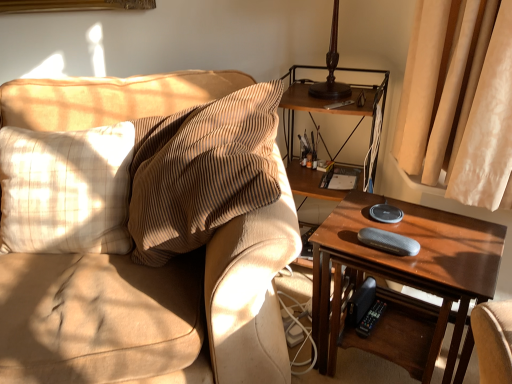
Question: From a real-world perspective, is beige plaid pillow at left positioned above or below wooden shelf at right?

Choices:
 (A) below
 (B) above

Answer: (B)

Question: From their relative heights in the image, would you say beige plaid pillow at left is taller or shorter than wooden shelf at right?

Choices:
 (A) short
 (B) tall

Answer: (A)

Question: Considering the real-world distances, which object is closest to the wooden shelf at right?

Choices:
 (A) textured beige couch at left
 (B) wooden table at right
 (C) beige plaid pillow at left

Answer: (B)

Question: Considering the real-world distances, which object is closest to the beige plaid pillow at left?

Choices:
 (A) wooden table at right
 (B) wooden shelf at right
 (C) textured beige couch at left

Answer: (C)